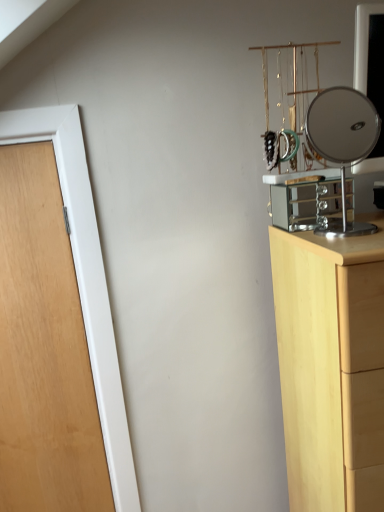
Question: Is light wood chest of drawers at right next to wooden door at left?

Choices:
 (A) yes
 (B) no

Answer: (B)

Question: Is light wood chest of drawers at right facing towards wooden door at left?

Choices:
 (A) no
 (B) yes

Answer: (A)

Question: Is light wood chest of drawers at right not near wooden door at left?

Choices:
 (A) yes
 (B) no

Answer: (B)

Question: Does light wood chest of drawers at right appear on the right side of wooden door at left?

Choices:
 (A) no
 (B) yes

Answer: (B)

Question: From the image's perspective, is light wood chest of drawers at right located beneath wooden door at left?

Choices:
 (A) yes
 (B) no

Answer: (A)

Question: Considering the positions of polished silver mirror at right and wooden door at left in the image, is polished silver mirror at right bigger or smaller than wooden door at left?

Choices:
 (A) big
 (B) small

Answer: (B)

Question: Is polished silver mirror at right taller or shorter than wooden door at left?

Choices:
 (A) short
 (B) tall

Answer: (A)

Question: Is polished silver mirror at right spatially inside wooden door at left, or outside of it?

Choices:
 (A) inside
 (B) outside

Answer: (B)

Question: Would you say polished silver mirror at right is to the left or to the right of wooden door at left in the picture?

Choices:
 (A) left
 (B) right

Answer: (B)

Question: Is point (319, 126) closer or farther from the camera than point (319, 246)?

Choices:
 (A) closer
 (B) farther

Answer: (B)

Question: From a real-world perspective, is polished silver mirror at right physically located above or below light wood chest of drawers at right?

Choices:
 (A) above
 (B) below

Answer: (A)

Question: Is polished silver mirror at right in front of or behind light wood chest of drawers at right in the image?

Choices:
 (A) front
 (B) behind

Answer: (B)

Question: In terms of size, does polished silver mirror at right appear bigger or smaller than light wood chest of drawers at right?

Choices:
 (A) small
 (B) big

Answer: (A)

Question: From the image's perspective, is light wood chest of drawers at right positioned above or below polished silver mirror at right?

Choices:
 (A) above
 (B) below

Answer: (B)

Question: Is light wood chest of drawers at right situated inside polished silver mirror at right or outside?

Choices:
 (A) outside
 (B) inside

Answer: (A)